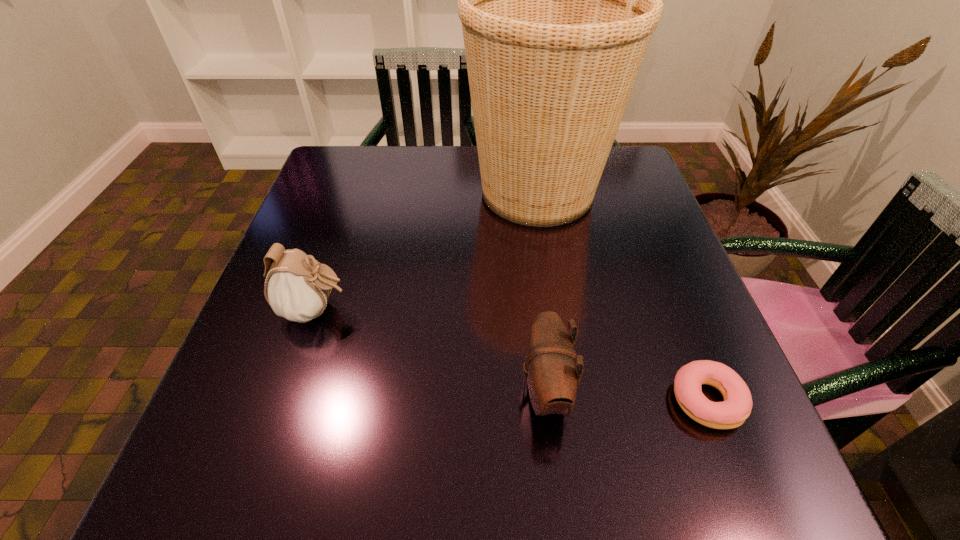
Locate an element on the screen. This screenshot has width=960, height=540. blank space located 0.280m with the flap open on the right pouch is located at coordinates (351, 390).

The width and height of the screenshot is (960, 540). I want to click on free region located on the back of the shortest object, so click(658, 274).

The image size is (960, 540). I want to click on object that is at the far edge, so click(x=558, y=0).

Where is `object that is positioned at the left edge`? The image size is (960, 540). object that is positioned at the left edge is located at coordinates (298, 289).

Find the location of a particular element. basket that is positioned at the right edge is located at coordinates click(x=558, y=0).

This screenshot has width=960, height=540. Find the location of `doughnut that is at the right edge`. doughnut that is at the right edge is located at coordinates (731, 413).

Where is `object that is positioned at the far right corner`? This screenshot has height=540, width=960. object that is positioned at the far right corner is located at coordinates (558, 0).

Find the location of a particular element. This screenshot has height=540, width=960. blank space at the far edge is located at coordinates (469, 155).

Locate an element on the screen. Image resolution: width=960 pixels, height=540 pixels. free space at the near edge of the desktop is located at coordinates (565, 499).

This screenshot has width=960, height=540. Identify the location of free space at the left edge of the desktop. (348, 233).